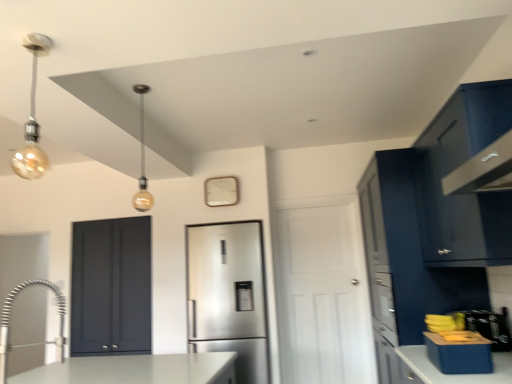
Question: From the image's perspective, is satin nickel faucet at lower left beneath matte dark blue cabinet at left, the second door positioned from the right?

Choices:
 (A) yes
 (B) no

Answer: (B)

Question: Is satin nickel faucet at lower left turned away from matte dark blue cabinet at left, the second door positioned from the right?

Choices:
 (A) yes
 (B) no

Answer: (B)

Question: Are satin nickel faucet at lower left and matte dark blue cabinet at left, the second door positioned from the right, located far from each other?

Choices:
 (A) yes
 (B) no

Answer: (B)

Question: From a real-world perspective, is satin nickel faucet at lower left located higher than matte dark blue cabinet at left, the second door positioned from the right?

Choices:
 (A) yes
 (B) no

Answer: (B)

Question: Is satin nickel faucet at lower left smaller than matte dark blue cabinet at left, which appears as the 1th door when viewed from the left?

Choices:
 (A) no
 (B) yes

Answer: (B)

Question: From the image's perspective, is satin nickel faucet at lower left positioned above or below gold metallic light bulb at upper left, the 1th light fixture from the back?

Choices:
 (A) above
 (B) below

Answer: (B)

Question: Is satin nickel faucet at lower left bigger or smaller than gold metallic light bulb at upper left, acting as the 2th light fixture starting from the left?

Choices:
 (A) small
 (B) big

Answer: (B)

Question: Considering their positions, is satin nickel faucet at lower left located in front of or behind gold metallic light bulb at upper left, the 1th light fixture positioned from the right?

Choices:
 (A) behind
 (B) front

Answer: (B)

Question: Would you say satin nickel faucet at lower left is to the left or to the right of gold metallic light bulb at upper left, the 1th light fixture from the back, in the picture?

Choices:
 (A) right
 (B) left

Answer: (B)

Question: Looking at the image, does white matte door at center, which is counted as the 1th door, starting from the right, seem bigger or smaller compared to matte dark blue cabinet at left, which appears as the 1th door when viewed from the left?

Choices:
 (A) big
 (B) small

Answer: (A)

Question: From the image's perspective, is white matte door at center, which is counted as the 1th door, starting from the right, above or below matte dark blue cabinet at left, the second door positioned from the right?

Choices:
 (A) above
 (B) below

Answer: (B)

Question: In the image, is white matte door at center, which is counted as the 1th door, starting from the right, on the left side or the right side of matte dark blue cabinet at left, the second door positioned from the right?

Choices:
 (A) left
 (B) right

Answer: (B)

Question: Considering the positions of point pyautogui.click(x=349, y=352) and point pyautogui.click(x=90, y=352), is point pyautogui.click(x=349, y=352) closer or farther from the camera than point pyautogui.click(x=90, y=352)?

Choices:
 (A) closer
 (B) farther

Answer: (B)

Question: Is gold bulb at upper left, which appears as the second light fixture when viewed from the back, taller or shorter than matte dark blue cabinet at left, the second door positioned from the right?

Choices:
 (A) tall
 (B) short

Answer: (B)

Question: Does point (42, 160) appear closer or farther from the camera than point (130, 294)?

Choices:
 (A) closer
 (B) farther

Answer: (A)